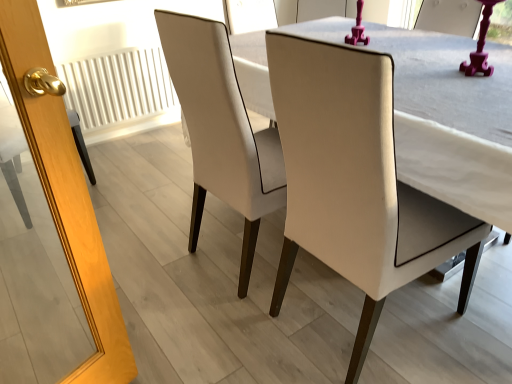
Question: Is white textured radiator at left looking in the opposite direction of matte white chair at center, the 1th chair in the right-to-left sequence?

Choices:
 (A) yes
 (B) no

Answer: (B)

Question: Does white textured radiator at left come behind matte white chair at center, which is counted as the 2th chair, starting from the left?

Choices:
 (A) no
 (B) yes

Answer: (B)

Question: Does white textured radiator at left have a greater height compared to matte white chair at center, which is counted as the 2th chair, starting from the left?

Choices:
 (A) no
 (B) yes

Answer: (A)

Question: From a real-world perspective, does white textured radiator at left sit lower than matte white chair at center, which is counted as the 2th chair, starting from the left?

Choices:
 (A) yes
 (B) no

Answer: (A)

Question: Is white textured radiator at left touching matte white chair at center, which is counted as the 2th chair, starting from the left?

Choices:
 (A) yes
 (B) no

Answer: (B)

Question: From the image's perspective, is matte white chair at center, the 1th chair in the right-to-left sequence, located above or below white textured radiator at left?

Choices:
 (A) below
 (B) above

Answer: (A)

Question: Considering the positions of matte white chair at center, the 1th chair in the right-to-left sequence, and white textured radiator at left in the image, is matte white chair at center, the 1th chair in the right-to-left sequence, bigger or smaller than white textured radiator at left?

Choices:
 (A) big
 (B) small

Answer: (A)

Question: From a real-world perspective, is matte white chair at center, which is counted as the 2th chair, starting from the left, physically located above or below white textured radiator at left?

Choices:
 (A) below
 (B) above

Answer: (B)

Question: Choose the correct answer: Is matte white chair at center, which is counted as the 2th chair, starting from the left, inside white textured radiator at left or outside it?

Choices:
 (A) outside
 (B) inside

Answer: (A)

Question: Considering the positions of matte white chair at center, which is counted as the 2th chair, starting from the left, and white leather chair at center, arranged as the first chair when viewed from the left, in the image, is matte white chair at center, which is counted as the 2th chair, starting from the left, taller or shorter than white leather chair at center, arranged as the first chair when viewed from the left,?

Choices:
 (A) short
 (B) tall

Answer: (A)

Question: From a real-world perspective, is matte white chair at center, the 1th chair in the right-to-left sequence, positioned above or below white leather chair at center, which is the 2th chair in right-to-left order?

Choices:
 (A) above
 (B) below

Answer: (B)

Question: In the image, is matte white chair at center, the 1th chair in the right-to-left sequence, on the left side or the right side of white leather chair at center, arranged as the first chair when viewed from the left?

Choices:
 (A) left
 (B) right

Answer: (B)

Question: Which is correct: matte white chair at center, which is counted as the 2th chair, starting from the left, is inside white leather chair at center, arranged as the first chair when viewed from the left, or outside of it?

Choices:
 (A) inside
 (B) outside

Answer: (B)

Question: Is white textured radiator at left spatially inside white leather chair at center, arranged as the first chair when viewed from the left, or outside of it?

Choices:
 (A) inside
 (B) outside

Answer: (B)

Question: Considering their positions, is white textured radiator at left located in front of or behind white leather chair at center, arranged as the first chair when viewed from the left?

Choices:
 (A) behind
 (B) front

Answer: (A)